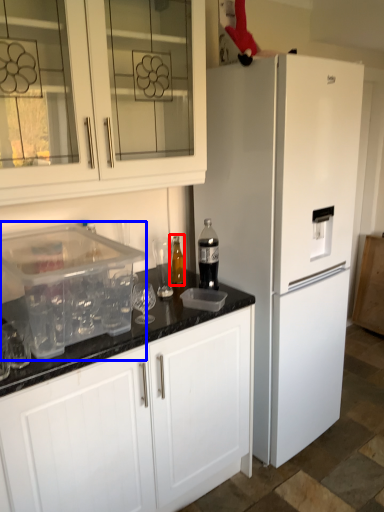
Question: Among these objects, which one is nearest to the camera, bottle (highlighted by a red box) or appliance (highlighted by a blue box)?

Choices:
 (A) bottle
 (B) appliance

Answer: (B)